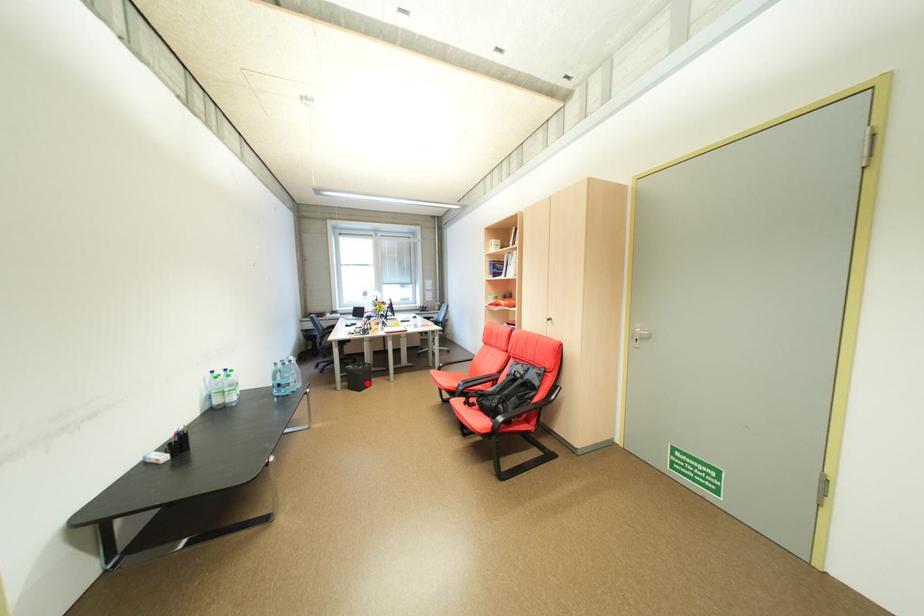
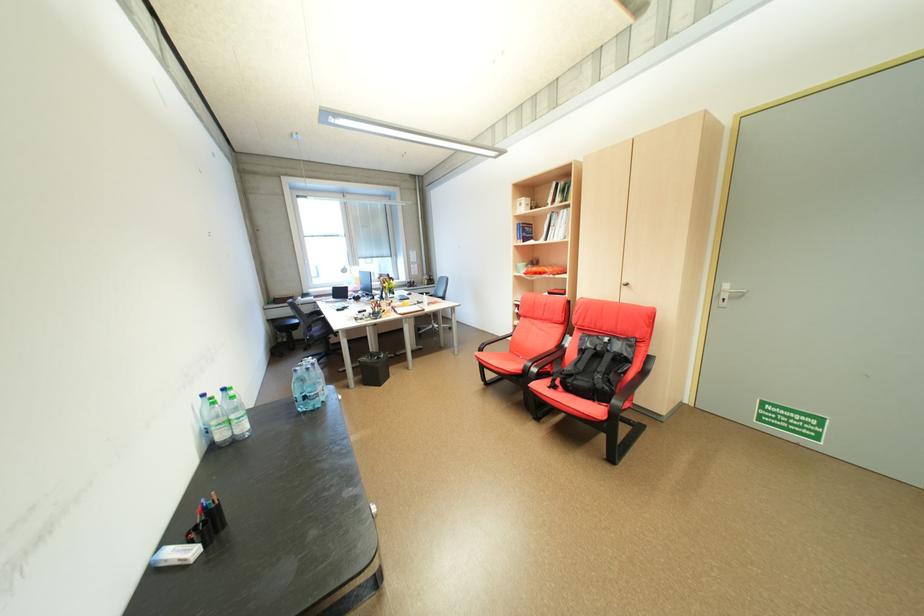
Locate, in the second image, the point that corresponds to the highlighted location in the first image.

(382, 377)